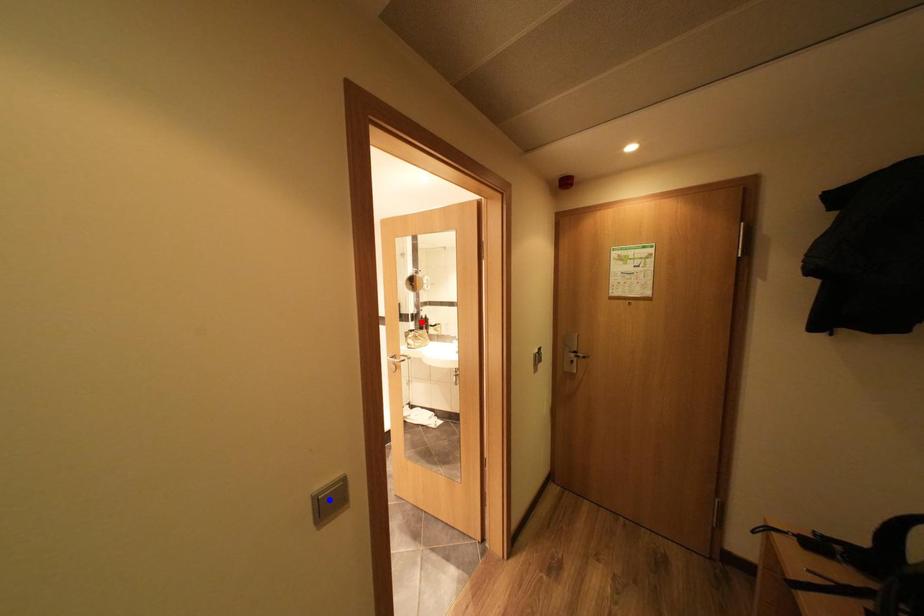
Question: In the image, two points are highlighted. Which point is nearer to the camera? Reply with the corresponding letter.

Choices:
 (A) blue point
 (B) red point

Answer: (A)